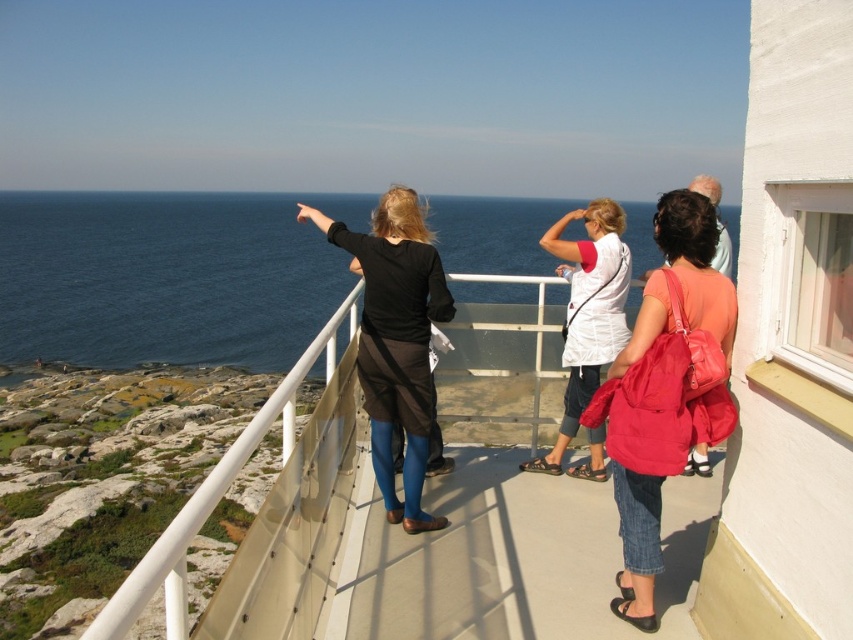
Question: Is black matte skirt at center thinner than white cotton shirt at center?

Choices:
 (A) yes
 (B) no

Answer: (A)

Question: Which is nearer to the black matte skirt at center?

Choices:
 (A) white cotton shirt at center
 (B) denim jacket at lower right

Answer: (B)

Question: Which object is the closest to the white cotton shirt at center?

Choices:
 (A) denim jacket at lower right
 (B) blue water at upper left

Answer: (A)

Question: Observing the image, what is the correct spatial positioning of blue water at upper left in reference to denim jacket at lower right?

Choices:
 (A) below
 (B) above

Answer: (B)

Question: Which point is closer to the camera taking this photo?

Choices:
 (A) (3, 266)
 (B) (593, 472)
 (C) (387, 227)

Answer: (C)

Question: Is blue water at upper left to the left of denim jacket at lower right from the viewer's perspective?

Choices:
 (A) no
 (B) yes

Answer: (B)